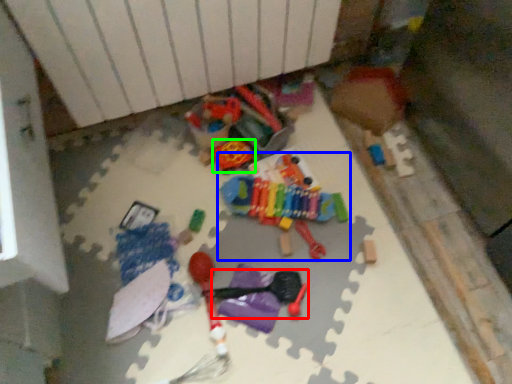
Question: Estimate the real-world distances between objects in this image. Which object is farther from toy (highlighted by a red box), toy (highlighted by a blue box) or toy (highlighted by a green box)?

Choices:
 (A) toy
 (B) toy

Answer: (B)